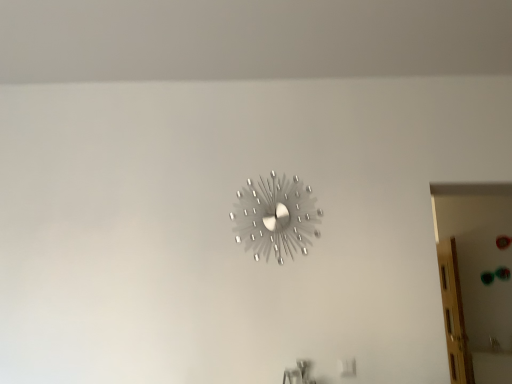
Question: Should I look upward or downward to see translucent wood door at right?

Choices:
 (A) down
 (B) up

Answer: (A)

Question: From the image's perspective, does metallic silver wall clock at center appear higher than translucent wood door at right?

Choices:
 (A) yes
 (B) no

Answer: (A)

Question: Does metallic silver wall clock at center come in front of translucent wood door at right?

Choices:
 (A) no
 (B) yes

Answer: (B)

Question: Is metallic silver wall clock at center next to translucent wood door at right and touching it?

Choices:
 (A) no
 (B) yes

Answer: (A)

Question: Is translucent wood door at right a part of metallic silver wall clock at center?

Choices:
 (A) no
 (B) yes

Answer: (A)

Question: Does metallic silver wall clock at center have a lesser height compared to translucent wood door at right?

Choices:
 (A) no
 (B) yes

Answer: (B)

Question: Does metallic silver wall clock at center have a greater width compared to translucent wood door at right?

Choices:
 (A) no
 (B) yes

Answer: (A)

Question: From the image's perspective, is translucent wood door at right on top of metallic silver wall clock at center?

Choices:
 (A) yes
 (B) no

Answer: (B)

Question: Does translucent wood door at right have a lesser height compared to metallic silver wall clock at center?

Choices:
 (A) yes
 (B) no

Answer: (B)

Question: Is translucent wood door at right oriented away from metallic silver wall clock at center?

Choices:
 (A) no
 (B) yes

Answer: (A)

Question: From the image's perspective, is translucent wood door at right located beneath metallic silver wall clock at center?

Choices:
 (A) no
 (B) yes

Answer: (B)

Question: Is the position of translucent wood door at right less distant than that of metallic silver wall clock at center?

Choices:
 (A) yes
 (B) no

Answer: (B)

Question: Is translucent wood door at right to the left of metallic silver wall clock at center from the viewer's perspective?

Choices:
 (A) no
 (B) yes

Answer: (A)

Question: Does point (445, 337) appear closer or farther from the camera than point (287, 249)?

Choices:
 (A) closer
 (B) farther

Answer: (B)